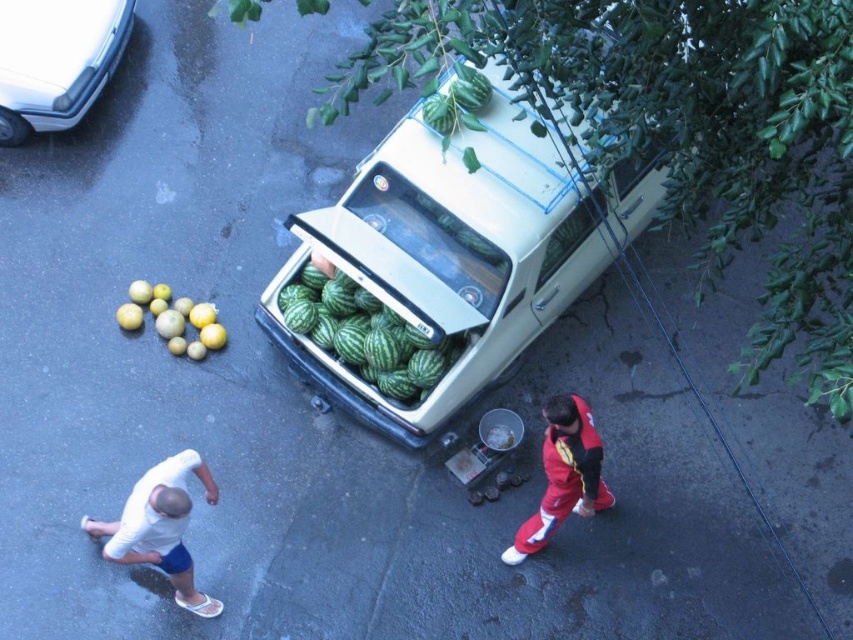
The height and width of the screenshot is (640, 853). Describe the element at coordinates (160, 528) in the screenshot. I see `white fabric shorts at lower left` at that location.

Is point (119, 524) positioned in front of point (140, 314)?

Yes, it is.

Identify the location of white fabric shorts at lower left. The width and height of the screenshot is (853, 640). (160, 528).

Which is in front, point (4, 141) or point (163, 326)?

Point (163, 326) is more forward.

Where is `white glossy car at upper left`? This screenshot has height=640, width=853. white glossy car at upper left is located at coordinates (56, 60).

Does green matte watermelon at center have a lesser width compared to green rind watermelon at center?

No.

From the picture: Which is more to the right, green matte watermelon at center or green rind watermelon at center?

green matte watermelon at center

Where is `green matte watermelon at center`? The image size is (853, 640). green matte watermelon at center is located at coordinates (461, 252).